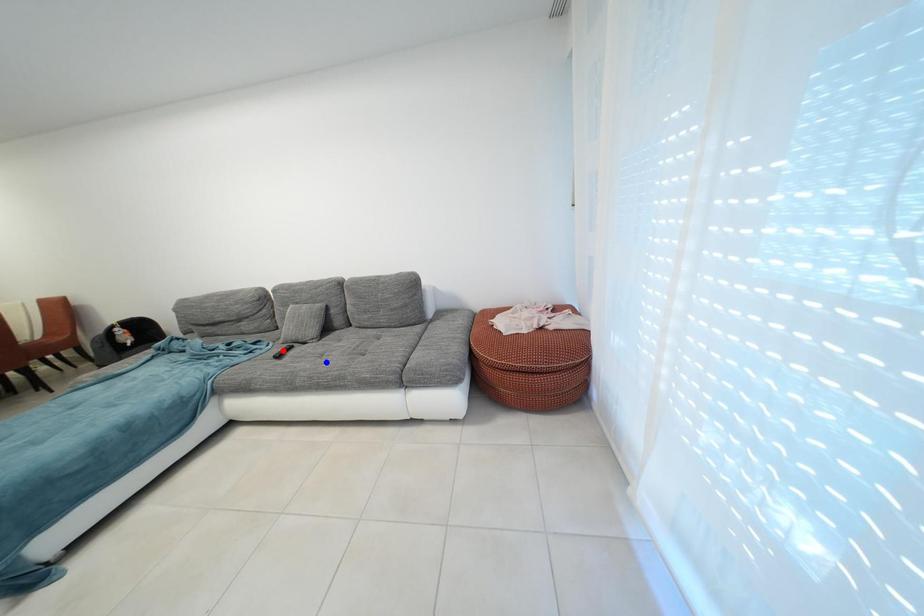
Question: Which of the two points in the image is closer to the camera?

Choices:
 (A) Blue point is closer.
 (B) Red point is closer.

Answer: (A)